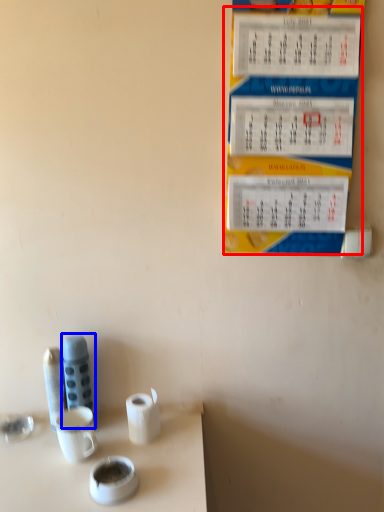
Question: Which of the following is the closest to the observer, menu (highlighted by a red box) or stationery (highlighted by a blue box)?

Choices:
 (A) menu
 (B) stationery

Answer: (A)